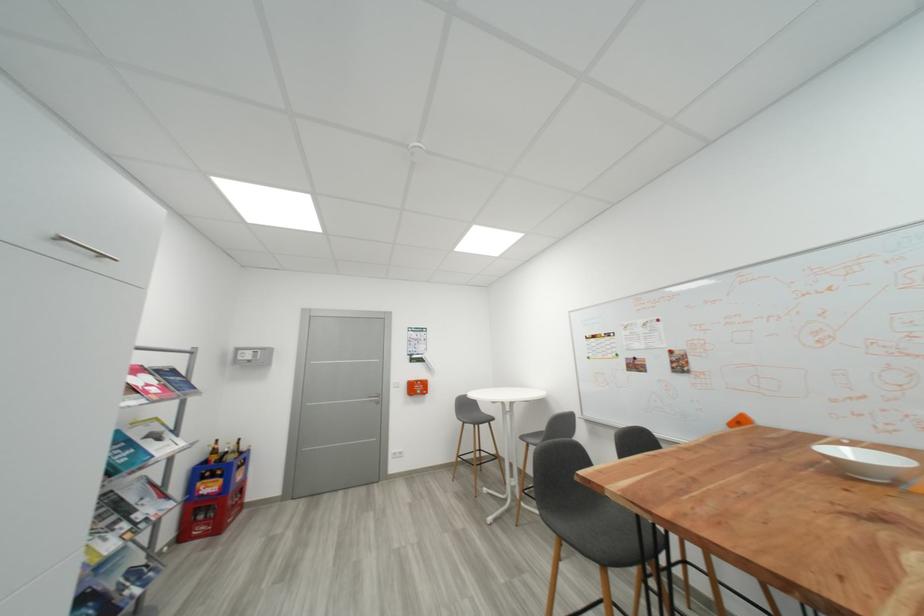
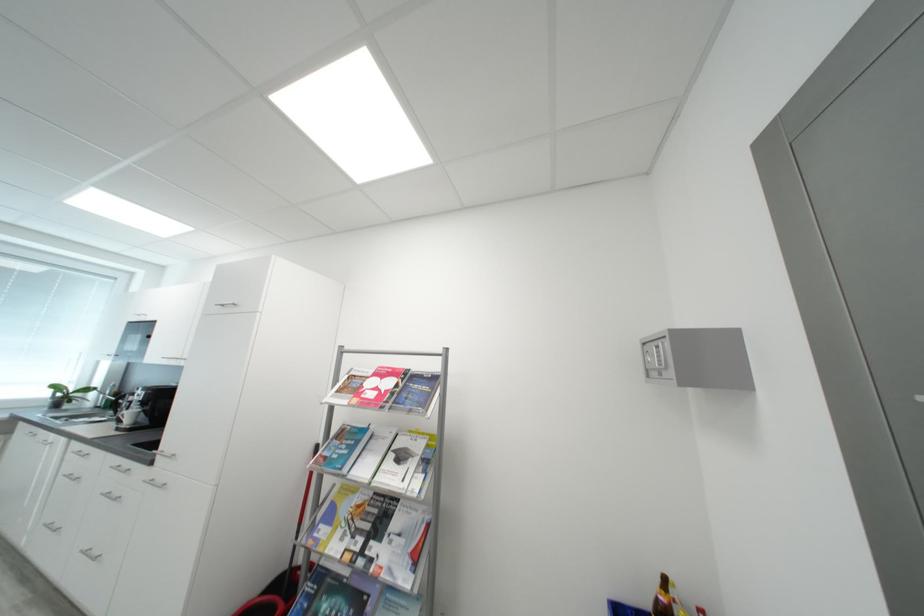
The point at (254, 358) is marked in the first image. Where is the corresponding point in the second image?

(660, 361)